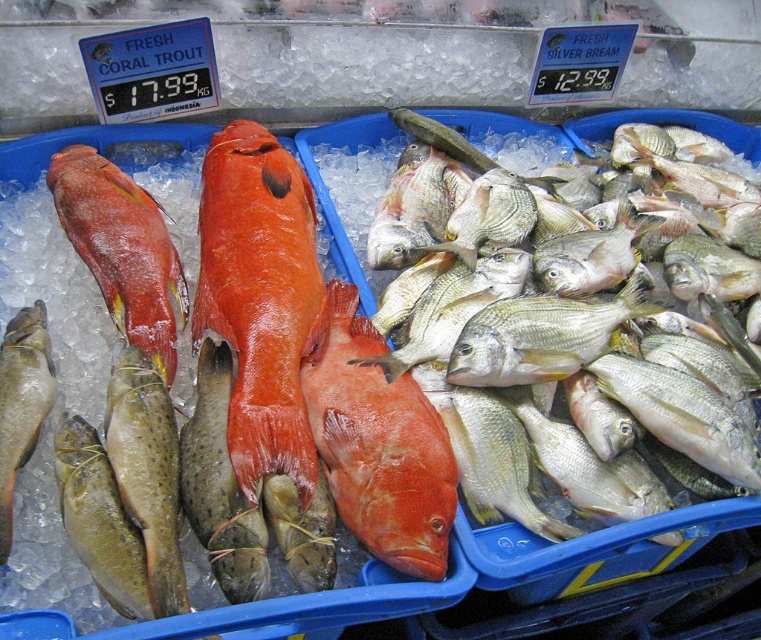
Between speckled yellow-green fish at lower left and speckled green fish at lower left, which one appears on the left side from the viewer's perspective?

Positioned to the left is speckled green fish at lower left.

Where is `speckled yellow-green fish at lower left`? This screenshot has height=640, width=761. speckled yellow-green fish at lower left is located at coordinates (147, 472).

Between matte red fish at center and speckled green fish at lower left, which one appears on the right side from the viewer's perspective?

matte red fish at center

Is the position of matte red fish at center more distant than that of speckled green fish at lower left?

Yes.

Who is more forward, (x=403, y=477) or (x=46, y=380)?

Point (x=403, y=477) is in front.

Find the location of `matte red fish at center`. matte red fish at center is located at coordinates (379, 445).

In the scene shown: Between shiny silver fish at center and matte red fish at center, which one appears on the left side from the viewer's perspective?

Positioned to the left is matte red fish at center.

Does shiny silver fish at center have a larger size compared to matte red fish at center?

Indeed, shiny silver fish at center has a larger size compared to matte red fish at center.

Where is `shiny silver fish at center`? shiny silver fish at center is located at coordinates (556, 310).